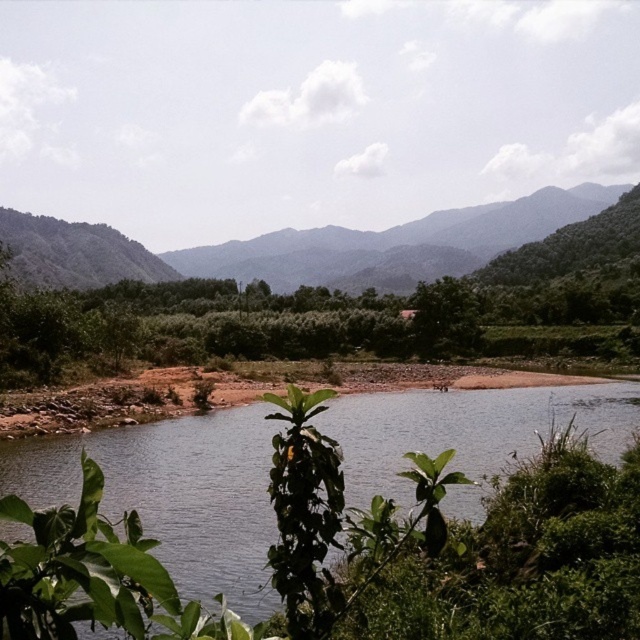
You are standing at the edge of the water and want to walk to the green leafy tree at center. Can you step onto the clear water at center to reach the tree?

The clear water at center is wider than the green leafy tree at center, so stepping onto the clear water at center would not be possible since water cannot support your weight, and the tree is on the other side.

You are standing at the edge of the clear water at center and want to walk towards the green leafy mountain at left. Which direction should you head?

You should head to the right because the clear water at center is to the left of the green leafy mountain at left, so moving right would take you towards it.

Based on the photo, you are an artist planning to paint this landscape. You want to ensure the green leafy mountain at left and the green leafy tree at center are proportionally accurate. Which one should you make wider in your painting?

The green leafy mountain at left should be made wider in the painting since its width is larger than the green leafy tree at center according to the description.